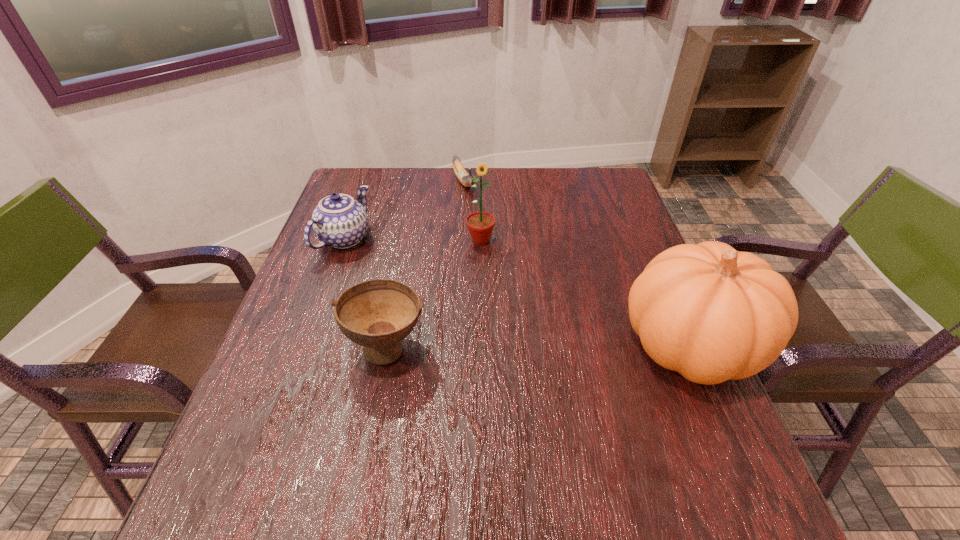
You are a GUI agent. You are given a task and a screenshot of the screen. Output one action in this format:
    pyautogui.click(x=<x>, y=<y>)
    Task: Click on the object that is at the right edge
    
    Given the screenshot: What is the action you would take?
    711,313

Find the location of a particular element. This screenshot has height=540, width=960. free space at the far edge is located at coordinates (534, 190).

Locate an element on the screen. The height and width of the screenshot is (540, 960). vacant area at the near edge is located at coordinates (372, 443).

Identify the location of free space at the left edge. (382, 215).

Where is `vacant region at the right edge of the desktop`? This screenshot has height=540, width=960. vacant region at the right edge of the desktop is located at coordinates (631, 228).

Locate an element on the screen. free region at the far left corner is located at coordinates (355, 189).

In the image, there is a desktop. At what (x,y) coordinates should I click in order to perform the action: click on vacant space at the far right corner. Please return your answer as a coordinate pair (x, y). The image size is (960, 540). Looking at the image, I should click on (624, 197).

The height and width of the screenshot is (540, 960). Identify the location of blank region between the leftmost object and the sunflower. (413, 239).

Locate an element on the screen. The height and width of the screenshot is (540, 960). empty space that is in between the sunflower and the pumpkin is located at coordinates [586, 293].

You are a GUI agent. You are given a task and a screenshot of the screen. Output one action in this format:
    pyautogui.click(x=<x>, y=<y>)
    Task: Click on the free spot between the banana and the fourth object from right to left
    This screenshot has width=960, height=540.
    Given the screenshot: What is the action you would take?
    pyautogui.click(x=425, y=265)